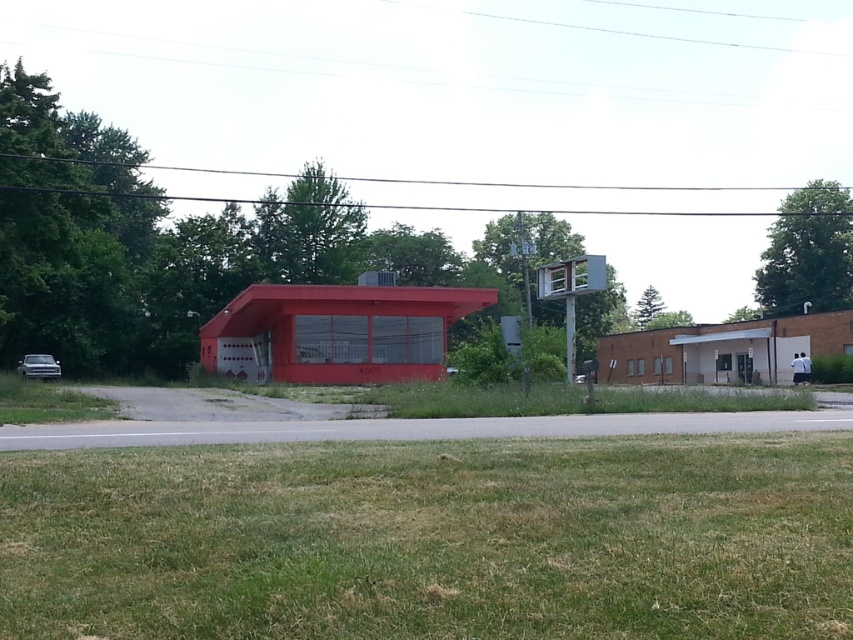
You are standing at the point with coordinates (335, 332) in the image. What is the object located exactly at that point?

The object located exactly at point (335, 332) is the matte red fire station at center.